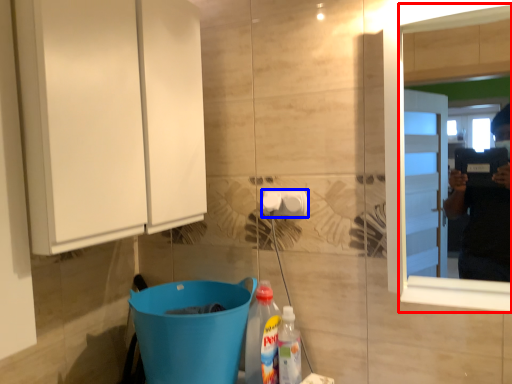
Question: Among these objects, which one is farthest to the camera, mirror (highlighted by a red box) or towel bar (highlighted by a blue box)?

Choices:
 (A) mirror
 (B) towel bar

Answer: (B)